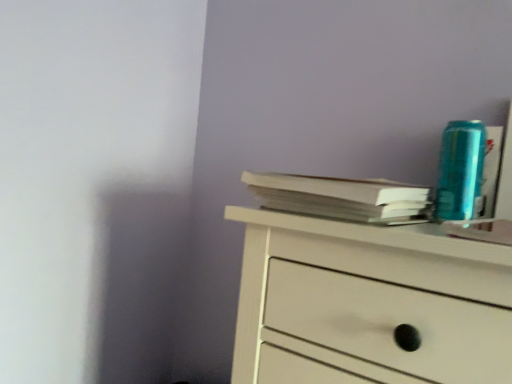
I want to click on white paper at upper right, so click(x=341, y=197).

In order to face white paper at upper right, should I rotate leftwards or rightwards?

Rotate right and turn 11.358 degrees.

Measure the distance between point (x=313, y=178) and camera.

The depth of point (x=313, y=178) is 57.70 centimeters.

The height and width of the screenshot is (384, 512). Describe the element at coordinates (341, 197) in the screenshot. I see `white paper at upper right` at that location.

What do you see at coordinates (460, 170) in the screenshot? The width and height of the screenshot is (512, 384). I see `teal metallic can at upper right` at bounding box center [460, 170].

Image resolution: width=512 pixels, height=384 pixels. Identify the location of teal metallic can at upper right. (460, 170).

Image resolution: width=512 pixels, height=384 pixels. In order to click on white paper at upper right in this screenshot , I will do `click(341, 197)`.

Between teal metallic can at upper right and white paper at upper right, which one appears on the right side from the viewer's perspective?

teal metallic can at upper right is more to the right.

Which object is further away from the camera, teal metallic can at upper right or white paper at upper right?

teal metallic can at upper right is more distant.

Is point (470, 172) less distant than point (391, 197)?

That is False.

From the image's perspective, is teal metallic can at upper right on white paper at upper right?

Correct, teal metallic can at upper right appears higher than white paper at upper right in the image.

From a real-world perspective, is teal metallic can at upper right physically located above or below white paper at upper right?

In terms of real-world spatial position, teal metallic can at upper right is above white paper at upper right.

Is teal metallic can at upper right wider or thinner than white paper at upper right?

Considering their sizes, teal metallic can at upper right looks slimmer than white paper at upper right.

Based on the photo, considering the relative sizes of teal metallic can at upper right and white paper at upper right in the image provided, is teal metallic can at upper right taller than white paper at upper right?

Yes, teal metallic can at upper right is taller than white paper at upper right.

Which of these two, teal metallic can at upper right or white paper at upper right, is smaller?

teal metallic can at upper right.

Which is correct: teal metallic can at upper right is inside white paper at upper right, or outside of it?

teal metallic can at upper right is not inside white paper at upper right, it's outside.

In the scene shown: Would you consider teal metallic can at upper right to be distant from white paper at upper right?

They are positioned close to each other.

Is teal metallic can at upper right oriented towards white paper at upper right?

No, teal metallic can at upper right is not facing towards white paper at upper right.

Can you tell me how much teal metallic can at upper right and white paper at upper right differ in facing direction?

The angular difference between teal metallic can at upper right and white paper at upper right is 0.000103 degrees.

Locate an element on the screen. The image size is (512, 384). paperback book below the teal metallic can at upper right (from a real-world perspective) is located at coordinates (341, 197).

Between white paper at upper right and teal metallic can at upper right, which one appears on the left side from the viewer's perspective?

From the viewer's perspective, white paper at upper right appears more on the left side.

Does white paper at upper right lie behind teal metallic can at upper right?

No, the depth of white paper at upper right is less than that of teal metallic can at upper right.

Is point (323, 198) positioned in front of point (458, 204)?

Yes.

From the image's perspective, who appears lower, white paper at upper right or teal metallic can at upper right?

white paper at upper right is shown below in the image.

From a real-world perspective, is white paper at upper right located beneath teal metallic can at upper right?

Indeed, from a real-world perspective, white paper at upper right is positioned beneath teal metallic can at upper right.

Which of these two, white paper at upper right or teal metallic can at upper right, is thinner?

With smaller width is teal metallic can at upper right.

Considering the sizes of objects white paper at upper right and teal metallic can at upper right in the image provided, who is taller, white paper at upper right or teal metallic can at upper right?

With more height is teal metallic can at upper right.

Based on their sizes in the image, would you say white paper at upper right is bigger or smaller than teal metallic can at upper right?

In the image, white paper at upper right appears to be larger than teal metallic can at upper right.

Based on the photo, is white paper at upper right spatially inside teal metallic can at upper right, or outside of it?

white paper at upper right is not inside teal metallic can at upper right, it's outside.

Would you consider white paper at upper right to be distant from teal metallic can at upper right?

No, there isn't a large distance between white paper at upper right and teal metallic can at upper right.

Is white paper at upper right oriented towards teal metallic can at upper right?

No, white paper at upper right is not facing towards teal metallic can at upper right.

Can you tell me how much white paper at upper right and teal metallic can at upper right differ in facing direction?

They differ by 0.000103 degrees in their facing directions.

Locate an element on the screen. The image size is (512, 384). teal above the white paper at upper right (from the image's perspective) is located at coordinates (460, 170).

The height and width of the screenshot is (384, 512). What are the coordinates of `teal on the right of white paper at upper right` in the screenshot? It's located at (460, 170).

Where is `paperback book below the teal metallic can at upper right (from a real-world perspective)`? The width and height of the screenshot is (512, 384). paperback book below the teal metallic can at upper right (from a real-world perspective) is located at coordinates pyautogui.click(x=341, y=197).